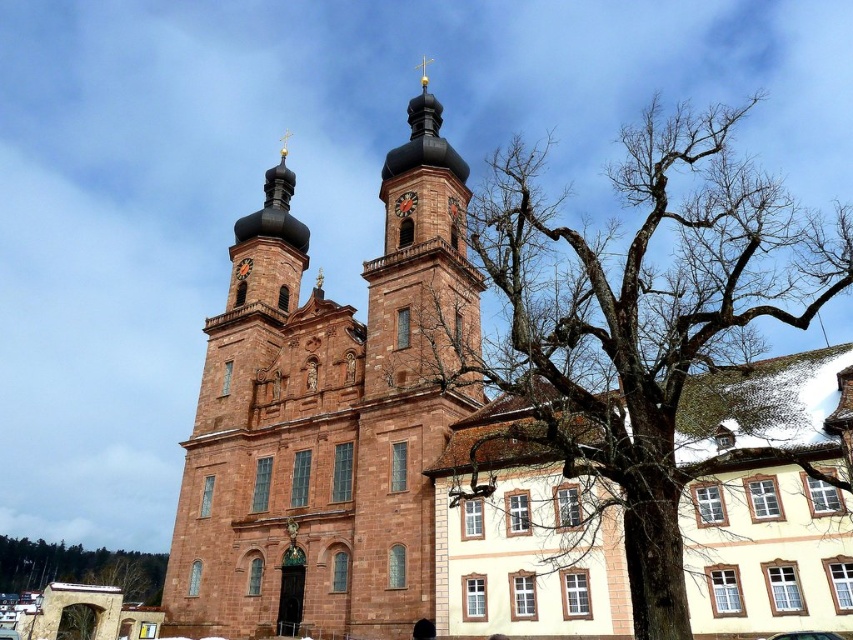
Between brown stone tower at center and dark brown wooden clock at upper center, which one is positioned higher?

Positioned higher is brown stone tower at center.

Can you confirm if brown stone tower at center is wider than dark brown wooden clock at upper center?

Yes, brown stone tower at center is wider than dark brown wooden clock at upper center.

Does point (399, 369) come farther from viewer compared to point (399, 214)?

No, (399, 369) is closer to viewer.

Identify the location of brown stone tower at center. The image size is (853, 640). (421, 260).

Is point (664, 637) closer to camera compared to point (68, 561)?

That is True.

Does point (735, 266) come behind point (154, 589)?

No, it is not.

Between point (566, 508) and point (1, 586), which one is positioned in front?

Positioned in front is point (566, 508).

This screenshot has width=853, height=640. What are the coordinates of `bare branches at center` in the screenshot? It's located at (639, 337).

Is matte reddish-brown church tower at center taller than brown stone tower at center?

Yes.

Does matte reddish-brown church tower at center appear under brown stone tower at center?

Yes, matte reddish-brown church tower at center is below brown stone tower at center.

Does point (248, 353) come farther from viewer compared to point (440, 259)?

Yes, it is behind point (440, 259).

The image size is (853, 640). Identify the location of matte reddish-brown church tower at center. [328, 416].